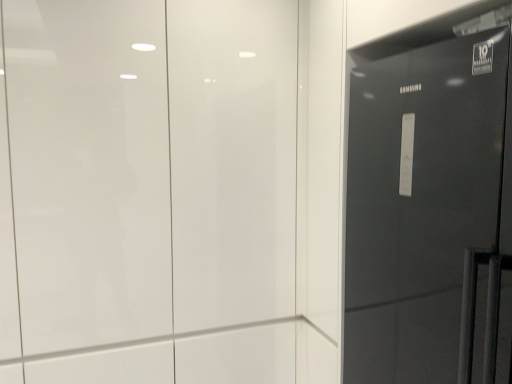
Question: From the image's perspective, is white glossy door at upper center, acting as the 2th door starting from the right, over glossy black refrigerator at right, which is the second door in left-to-right order?

Choices:
 (A) yes
 (B) no

Answer: (A)

Question: Is glossy black refrigerator at right, which appears as the 1th door when viewed from the right, surrounded by white glossy door at upper center, acting as the 2th door starting from the right?

Choices:
 (A) yes
 (B) no

Answer: (B)

Question: Would you say white glossy door at upper center, the first door in the left-to-right sequence, is outside glossy black refrigerator at right, which is the second door in left-to-right order?

Choices:
 (A) no
 (B) yes

Answer: (B)

Question: Can you confirm if white glossy door at upper center, the first door in the left-to-right sequence, is bigger than glossy black refrigerator at right, which appears as the 1th door when viewed from the right?

Choices:
 (A) no
 (B) yes

Answer: (B)

Question: Can you confirm if white glossy door at upper center, the first door in the left-to-right sequence, is positioned to the right of glossy black refrigerator at right, which is the second door in left-to-right order?

Choices:
 (A) no
 (B) yes

Answer: (A)

Question: From the image's perspective, would you say white glossy door at upper center, acting as the 2th door starting from the right, is shown under glossy black refrigerator at right, which appears as the 1th door when viewed from the right?

Choices:
 (A) yes
 (B) no

Answer: (B)

Question: Does glossy black refrigerator at right, which appears as the 1th door when viewed from the right, lie in front of white glossy door at upper center, the first door in the left-to-right sequence?

Choices:
 (A) yes
 (B) no

Answer: (A)

Question: Is glossy black refrigerator at right, which is the second door in left-to-right order, positioned behind white glossy door at upper center, acting as the 2th door starting from the right?

Choices:
 (A) yes
 (B) no

Answer: (B)

Question: Does glossy black refrigerator at right, which is the second door in left-to-right order, have a smaller size compared to white glossy door at upper center, acting as the 2th door starting from the right?

Choices:
 (A) no
 (B) yes

Answer: (B)

Question: From the image's perspective, does glossy black refrigerator at right, which is the second door in left-to-right order, appear higher than white glossy door at upper center, acting as the 2th door starting from the right?

Choices:
 (A) yes
 (B) no

Answer: (B)

Question: Considering the relative sizes of glossy black refrigerator at right, which is the second door in left-to-right order, and white glossy door at upper center, the first door in the left-to-right sequence, in the image provided, is glossy black refrigerator at right, which is the second door in left-to-right order, shorter than white glossy door at upper center, the first door in the left-to-right sequence,?

Choices:
 (A) no
 (B) yes

Answer: (B)

Question: Considering the relative positions of glossy black refrigerator at right, which is the second door in left-to-right order, and white glossy door at upper center, the first door in the left-to-right sequence, in the image provided, is glossy black refrigerator at right, which is the second door in left-to-right order, to the right of white glossy door at upper center, the first door in the left-to-right sequence, from the viewer's perspective?

Choices:
 (A) no
 (B) yes

Answer: (B)

Question: Considering the positions of glossy black refrigerator at right, which appears as the 1th door when viewed from the right, and white glossy door at upper center, the first door in the left-to-right sequence, in the image, is glossy black refrigerator at right, which appears as the 1th door when viewed from the right, wider or thinner than white glossy door at upper center, the first door in the left-to-right sequence,?

Choices:
 (A) thin
 (B) wide

Answer: (B)